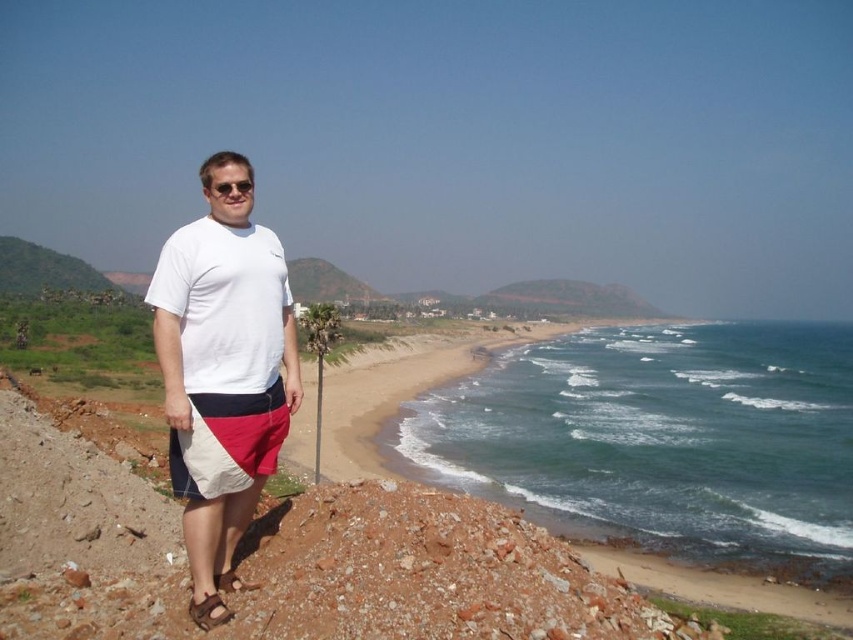
Does white cotton t-shirt at center appear under white cotton shorts at lower left?

Answer: No.

Looking at this image, between white cotton t-shirt at center and white cotton shorts at lower left, which one is positioned lower?

white cotton shorts at lower left is lower down.

Does point (207, 502) lie in front of point (201, 400)?

Yes.

Image resolution: width=853 pixels, height=640 pixels. I want to click on white cotton t-shirt at center, so click(223, 365).